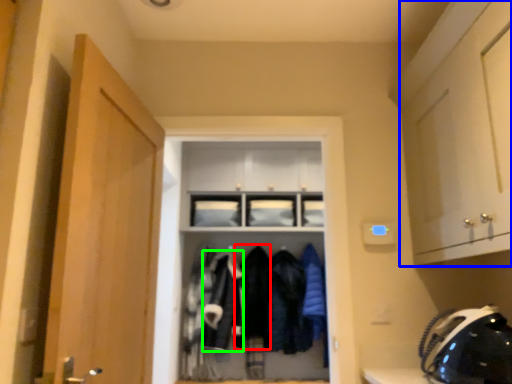
Question: Which is farther away from clothing (highlighted by a red box)? cabinetry (highlighted by a blue box) or clothing (highlighted by a green box)?

Choices:
 (A) cabinetry
 (B) clothing

Answer: (A)